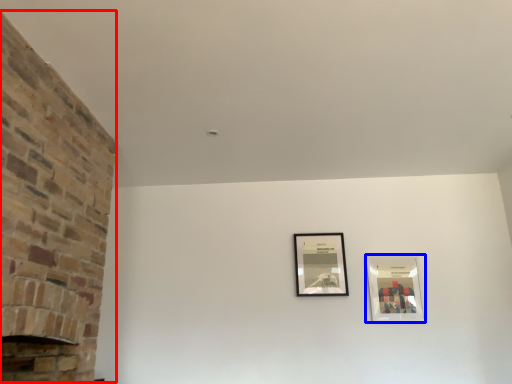
Question: Which object is closer to the camera taking this photo, fireplace (highlighted by a red box) or picture frame (highlighted by a blue box)?

Choices:
 (A) fireplace
 (B) picture frame

Answer: (A)